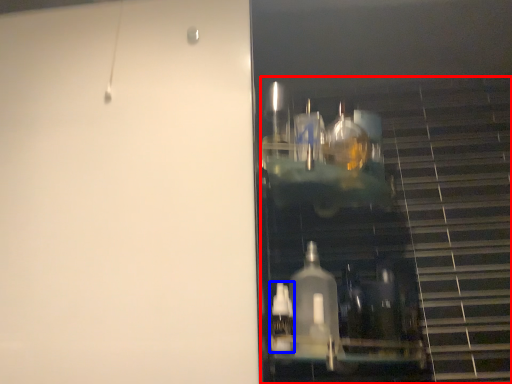
Question: Which of the following is the farthest to the observer, stairwell (highlighted by a red box) or bottle (highlighted by a blue box)?

Choices:
 (A) stairwell
 (B) bottle

Answer: (B)